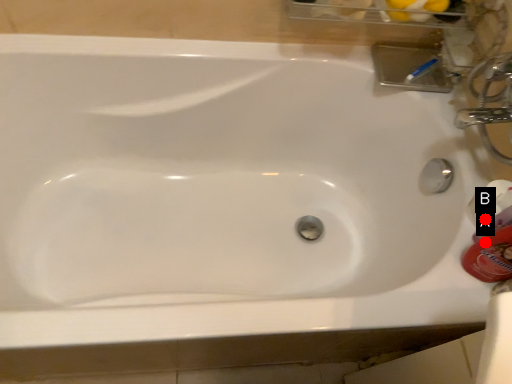
Question: Two points are circled on the image, labeled by A and B beside each circle. Which point is farther to the camera?

Choices:
 (A) A is further
 (B) B is further

Answer: (B)